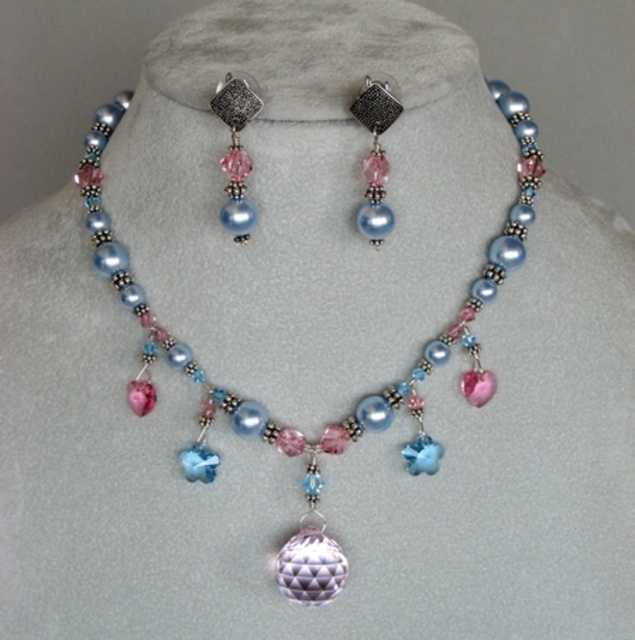
Question: Is pearl-like beads at center positioned before satin silver pendant at upper center?

Choices:
 (A) no
 (B) yes

Answer: (A)

Question: Considering the real-world distances, which object is farthest from the satin silver pendant at upper center?

Choices:
 (A) pearl-like beads at center
 (B) pearl-like pendant at upper center

Answer: (A)

Question: Can you confirm if pearl-like beads at center is thinner than satin silver pendant at upper center?

Choices:
 (A) yes
 (B) no

Answer: (B)

Question: Which point is farther to the camera?

Choices:
 (A) (243, 214)
 (B) (149, 371)

Answer: (B)

Question: Which object is the farthest from the pearl-like pendant at upper center?

Choices:
 (A) satin silver pendant at upper center
 (B) pearl-like beads at center

Answer: (B)

Question: Is pearl-like beads at center bigger than pearl-like pendant at upper center?

Choices:
 (A) no
 (B) yes

Answer: (B)